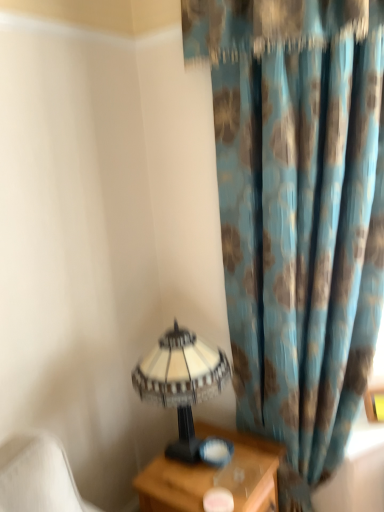
Identify the location of free point above wooden nightstand at lower right (from a real-world perspective). (203, 466).